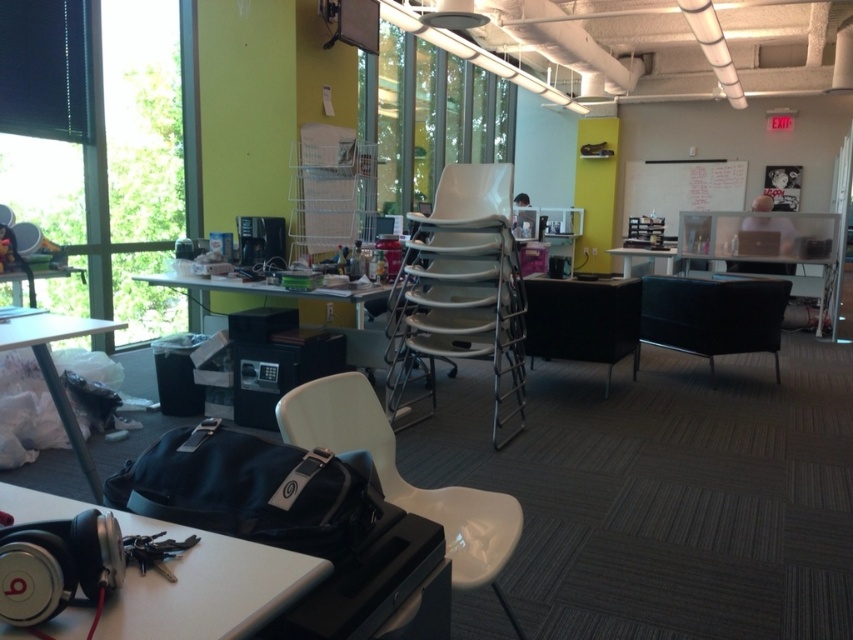
You are sitting in the black leather swivel chair at center and want to look out the transparent glass window at upper left. Can you see the window directly in front of you?

The transparent glass window at upper left is in front of the black leather swivel chair at center, so yes, you can see the window directly in front of you.